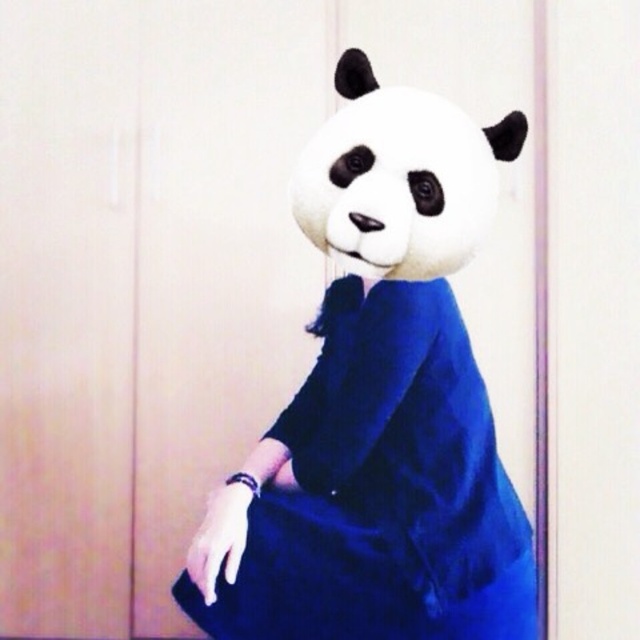
Who is positioned more to the right, velvet blue dress at center or white plush panda at center?

white plush panda at center

The image size is (640, 640). I want to click on velvet blue dress at center, so coord(381,490).